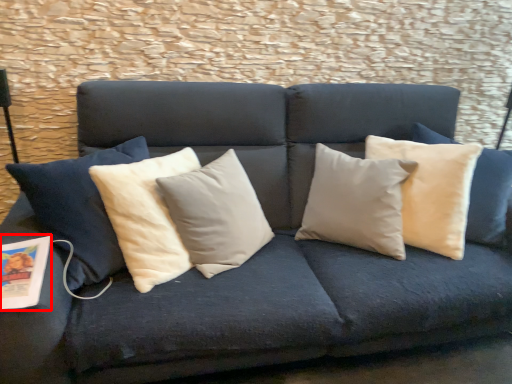
Question: From the image, what is the correct spatial relationship of magazine (annotated by the red box) in relation to pillow?

Choices:
 (A) right
 (B) left

Answer: (B)